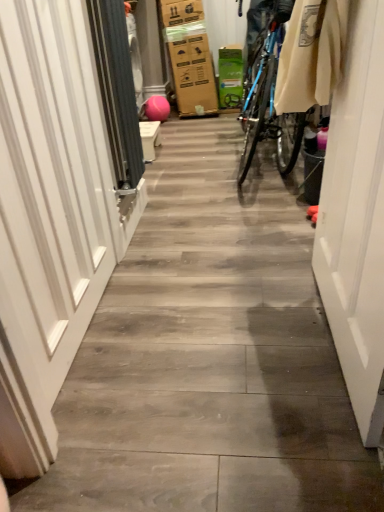
In order to click on gray fabric screen door at left in this screenshot , I will do `click(119, 110)`.

I want to click on white glossy door at right, so click(356, 220).

Who is bigger, white glossy door at left or gray fabric screen door at left?

white glossy door at left.

Is white glossy door at left to the left of gray fabric screen door at left from the viewer's perspective?

Correct, you'll find white glossy door at left to the left of gray fabric screen door at left.

Which is less distant, (89, 209) or (116, 169)?

The point (89, 209) is closer.

Find the location of `garage door on the left of the gray fabric screen door at left`. garage door on the left of the gray fabric screen door at left is located at coordinates (45, 223).

You are a GUI agent. You are given a task and a screenshot of the screen. Output one action in this format:
    pyautogui.click(x=<x>, y=<y>)
    Task: Click on the garage door on the left of white glossy door at right
    
    Given the screenshot: What is the action you would take?
    pyautogui.click(x=45, y=223)

From the image's perspective, which one is positioned lower, white glossy door at right or white glossy door at left?

white glossy door at right is shown below in the image.

Between white glossy door at right and gray fabric screen door at left, which one has smaller width?

white glossy door at right.

Based on the photo, based on their sizes in the image, would you say white glossy door at right is bigger or smaller than gray fabric screen door at left?

Considering their sizes, white glossy door at right takes up more space than gray fabric screen door at left.

Measure the distance from white glossy door at right to gray fabric screen door at left.

white glossy door at right and gray fabric screen door at left are 35.90 inches apart.

Is white glossy door at right not close to gray fabric screen door at left?

white glossy door at right is actually quite close to gray fabric screen door at left.

Does gray fabric screen door at left have a greater width compared to white glossy door at right?

Correct, the width of gray fabric screen door at left exceeds that of white glossy door at right.

Can you tell me how much gray fabric screen door at left and white glossy door at right differ in facing direction?

The angle between the facing direction of gray fabric screen door at left and the facing direction of white glossy door at right is 179 degrees.

Where is `door that is in front of the gray fabric screen door at left`? door that is in front of the gray fabric screen door at left is located at coordinates 356,220.

Between gray fabric screen door at left and white glossy door at right, which one has less height?

Standing shorter between the two is gray fabric screen door at left.

From a real-world perspective, which object stands above the other?

In real-world perspective, white glossy door at left is above.

What's the angular difference between white glossy door at left and white glossy door at right's facing directions?

The facing directions of white glossy door at left and white glossy door at right are 179 degrees apart.

Who is taller, white glossy door at left or white glossy door at right?

white glossy door at left is taller.

Between point (98, 222) and point (357, 398), which one is positioned in front?

The point (357, 398) is in front.

From a real-world perspective, which is physically above, gray fabric screen door at left or white glossy door at left?

gray fabric screen door at left is physically above.

Is the surface of gray fabric screen door at left in direct contact with white glossy door at left?

No, gray fabric screen door at left is not next to white glossy door at left.

Based on their sizes in the image, would you say gray fabric screen door at left is bigger or smaller than white glossy door at left?

Considering their sizes, gray fabric screen door at left takes up less space than white glossy door at left.

Is gray fabric screen door at left oriented away from white glossy door at left?

No.

The height and width of the screenshot is (512, 384). Find the location of `garage door on the left of gray fabric screen door at left`. garage door on the left of gray fabric screen door at left is located at coordinates (45, 223).

Identify the location of door located below the white glossy door at left (from the image's perspective). The width and height of the screenshot is (384, 512). (356, 220).

Looking at the image, which one is located further to white glossy door at left, gray fabric screen door at left or white glossy door at right?

Among the two, white glossy door at right is located further to white glossy door at left.

When comparing their distances from white glossy door at left, does white glossy door at right or gray fabric screen door at left seem closer?

gray fabric screen door at left is closer to white glossy door at left.

Looking at the image, which one is located closer to gray fabric screen door at left, white glossy door at left or white glossy door at right?

white glossy door at left is closer to gray fabric screen door at left.

In the scene shown: Based on their spatial positions, is white glossy door at right or white glossy door at left further from gray fabric screen door at left?

white glossy door at right is positioned further to the anchor gray fabric screen door at left.

Considering their positions, is white glossy door at left positioned closer to white glossy door at right than gray fabric screen door at left?

white glossy door at left.

Considering their positions, is gray fabric screen door at left positioned closer to white glossy door at right than white glossy door at left?

white glossy door at left.

Identify the location of garage door between white glossy door at right and gray fabric screen door at left along the z-axis. (45, 223).